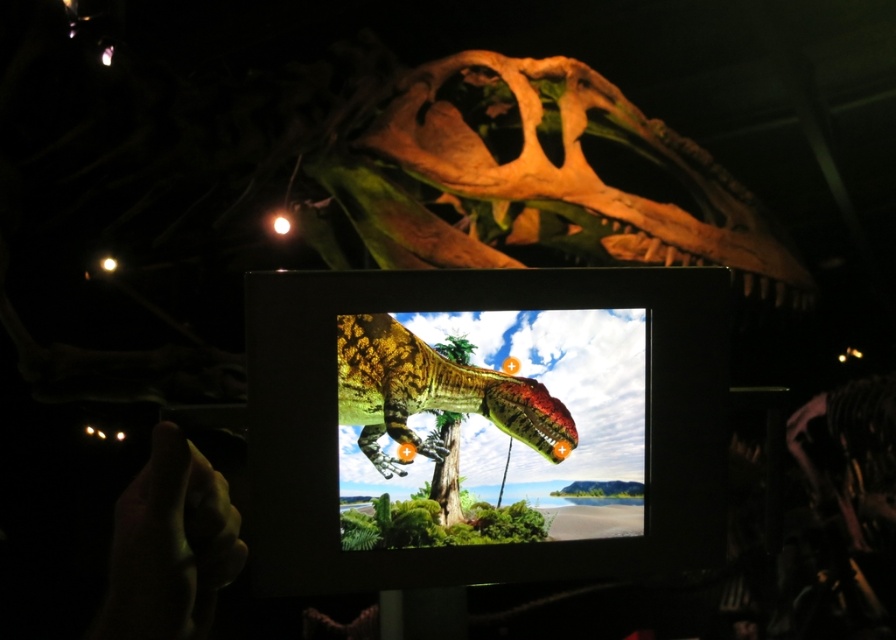
What object is located at the coordinates point [484,424] in the image?

The point [484,424] corresponds to the shiny plastic screen at center.

You are an artist trying to sketch the shiny green dinosaur at center. To get a better view, you need to move your hand holding the tablet away from the dinosaur. Which direction should you move the smooth skin hand at lower left?

You should move the smooth skin hand at lower left to the left, as it is currently positioned to the left of the shiny green dinosaur at center and needs to be moved further away from the dinosaur to the left side.